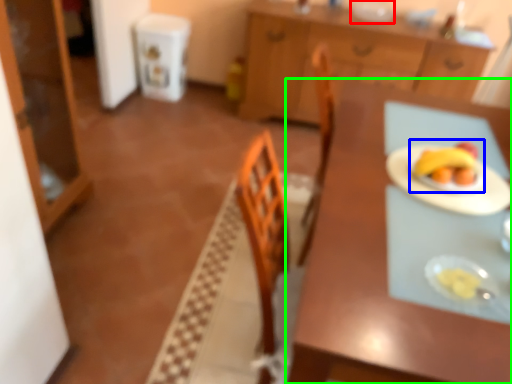
Question: Which object is positioned farthest from tableware (highlighted by a red box)? Select from fruit dish (highlighted by a blue box) and table (highlighted by a green box).

Choices:
 (A) fruit dish
 (B) table

Answer: (B)